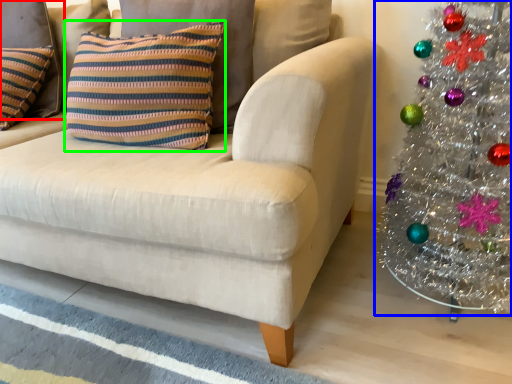
Question: Considering the real-world distances, which object is farthest from pillow (highlighted by a red box)? christmas tree (highlighted by a blue box) or pillow (highlighted by a green box)?

Choices:
 (A) christmas tree
 (B) pillow

Answer: (A)